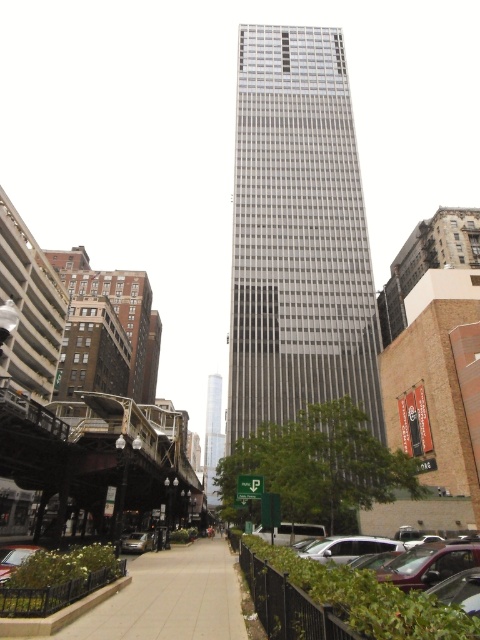
You are standing in the bustling urban scene looking at the skyscraper. There are two points marked in the image. The first point is at coordinates point (371, 614) and the second point is at coordinates point (433, 593). Which of these two points is closer to your viewpoint?

Point (371, 614) is closer to the camera than point (433, 593).

You are a city planner assessing the urban layout. You need to determine if the smooth concrete sidewalk at center can be seen from the top floor of the glassy reflective skyscraper at center. Based on their relative heights, can the sidewalk be viewed from there?

The smooth concrete sidewalk at center is not as tall as the glassy reflective skyscraper at center, so yes, the sidewalk can be viewed from the top floor of the skyscraper since the sidewalk is lower in height.